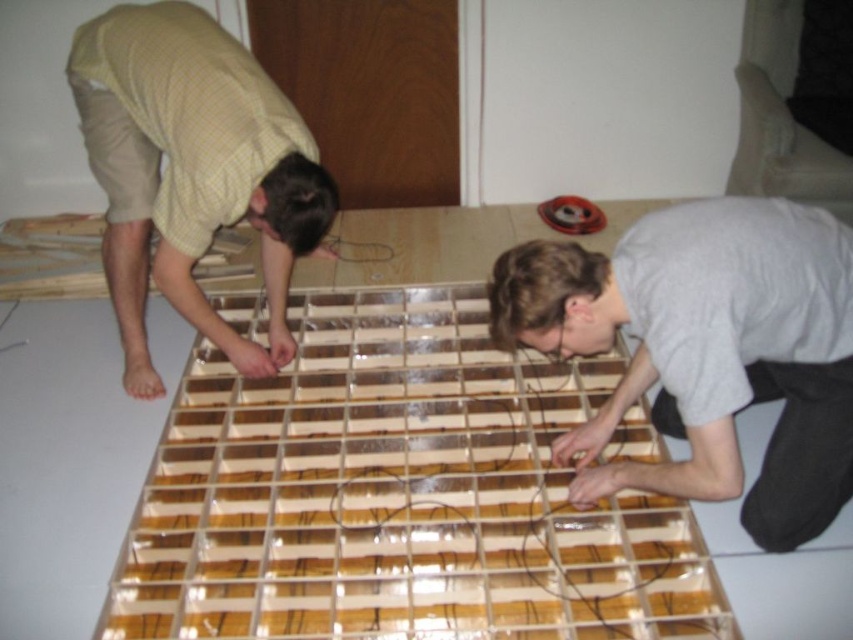
You are standing in front of the wooden grid structure and want to hand a tool to both the gray matte shirt at lower right and the matte yellow shirt at left. Which person should you approach first based on their proximity to you?

You should approach the gray matte shirt at lower right first because they are closer to you than the matte yellow shirt at left.

You are standing in front of the wooden grid structure and need to determine which worker is shorter. Based on the scene, can you identify which of the two workers, the gray matte shirt at lower right or the matte yellow shirt at left, is shorter?

The gray matte shirt at lower right has a lesser height compared to the matte yellow shirt at left, so the worker wearing the gray matte shirt at lower right is shorter.